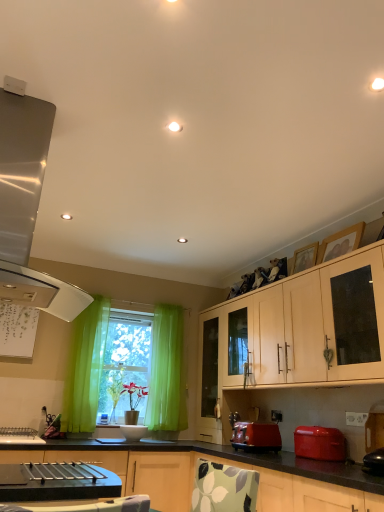
In the scene shown: What is the approximate width of wooden picture frame at upper right, the second picture frame when ordered from front to back?

wooden picture frame at upper right, the second picture frame when ordered from front to back, is 8.00 centimeters wide.

This screenshot has width=384, height=512. What do you see at coordinates (85, 368) in the screenshot? I see `green sheer curtain at window` at bounding box center [85, 368].

The image size is (384, 512). In order to click on green sheer curtain at window in this screenshot , I will do `click(85, 368)`.

Where is `wooden picture frame at upper right, which is the 1th picture frame from back to front`? The width and height of the screenshot is (384, 512). wooden picture frame at upper right, which is the 1th picture frame from back to front is located at coordinates (305, 258).

From the picture: Which of these two, matte red toaster at lower right or matte red toaster at lower center, is thinner?

matte red toaster at lower right.

From the image's perspective, is matte red toaster at lower right beneath matte red toaster at lower center?

No, from the image's perspective, matte red toaster at lower right is not beneath matte red toaster at lower center.

Based on their sizes in the image, would you say matte red toaster at lower right is bigger or smaller than matte red toaster at lower center?

Considering their sizes, matte red toaster at lower right takes up more space than matte red toaster at lower center.

The width and height of the screenshot is (384, 512). Find the location of `appliance on the right of matte red toaster at lower center`. appliance on the right of matte red toaster at lower center is located at coordinates (320, 443).

Which is behind, point (274, 414) or point (311, 442)?

The point (274, 414) is behind.

Would you say white plastic power outlet at lower right is inside or outside matte red toaster at lower right?

white plastic power outlet at lower right is spatially situated outside matte red toaster at lower right.

Is white plastic power outlet at lower right closer to camera compared to matte red toaster at lower right?

No, it is behind matte red toaster at lower right.

Is white plastic power outlet at lower right wider than matte red toaster at lower right?

No.

Is satin metallic range hood at left smaller than white plastic power outlet at lower right?

No, satin metallic range hood at left is not smaller than white plastic power outlet at lower right.

Is satin metallic range hood at left next to white plastic power outlet at lower right?

No, satin metallic range hood at left is not with white plastic power outlet at lower right.

Is satin metallic range hood at left to the left of white plastic power outlet at lower right from the viewer's perspective?

Correct, you'll find satin metallic range hood at left to the left of white plastic power outlet at lower right.

Does matte red toaster at lower center come behind white plastic power outlet at lower right?

That is False.

Is point (235, 433) more distant than point (275, 417)?

No, (235, 433) is in front of (275, 417).

Considering the sizes of objects matte red toaster at lower center and white plastic power outlet at lower right in the image provided, who is wider, matte red toaster at lower center or white plastic power outlet at lower right?

Wider between the two is matte red toaster at lower center.

Is matte red toaster at lower center positioned far away from white plastic power outlet at lower right?

No, there isn't a large distance between matte red toaster at lower center and white plastic power outlet at lower right.

Is white matte cabinet at upper right, which is the first cabinetry in top-to-bottom order, taller or shorter than green sheer curtain at window?

white matte cabinet at upper right, which is the first cabinetry in top-to-bottom order, is shorter than green sheer curtain at window.

Does white matte cabinet at upper right, the 2th cabinetry positioned from the bottom, have a larger size compared to green sheer curtain at window?

Yes.

Is white matte cabinet at upper right, the 2th cabinetry positioned from the bottom, wider than green sheer curtain at window?

Yes.

Is white plastic power outlet at lower right facing towards wooden picture frame at upper right, the second picture frame when ordered from back to front?

No, white plastic power outlet at lower right is not oriented towards wooden picture frame at upper right, the second picture frame when ordered from back to front.

Are white plastic power outlet at lower right and wooden picture frame at upper right, the 1th picture frame positioned from the front, located far from each other?

Yes, white plastic power outlet at lower right and wooden picture frame at upper right, the 1th picture frame positioned from the front, are quite far apart.

Is wooden picture frame at upper right, the second picture frame when ordered from back to front, inside white plastic power outlet at lower right?

Definitely not — wooden picture frame at upper right, the second picture frame when ordered from back to front, is not inside white plastic power outlet at lower right.

Based on the photo, considering the sizes of objects white plastic power outlet at lower right and wooden picture frame at upper right, the 1th picture frame positioned from the front, in the image provided, who is shorter, white plastic power outlet at lower right or wooden picture frame at upper right, the 1th picture frame positioned from the front,?

Standing shorter between the two is white plastic power outlet at lower right.

Looking at this image, how distant is wooden picture frame at upper right, which is the 1th picture frame from back to front, from matte red toaster at lower center?

They are 3.98 feet apart.

Is wooden picture frame at upper right, the second picture frame when ordered from front to back, not close to matte red toaster at lower center?

Absolutely, wooden picture frame at upper right, the second picture frame when ordered from front to back, is distant from matte red toaster at lower center.

Is wooden picture frame at upper right, which is the 1th picture frame from back to front, aimed at matte red toaster at lower center?

No, wooden picture frame at upper right, which is the 1th picture frame from back to front, is not oriented towards matte red toaster at lower center.

From the image's perspective, is wooden picture frame at upper right, which is the 1th picture frame from back to front, above or below matte red toaster at lower center?

Clearly, from the image's perspective, wooden picture frame at upper right, which is the 1th picture frame from back to front, is above matte red toaster at lower center.

Where is `toaster on the left of the matte red toaster at lower right`? This screenshot has width=384, height=512. toaster on the left of the matte red toaster at lower right is located at coordinates (256, 437).

At what (x,y) coordinates should I click in order to perform the action: click on appliance located underneath the white plastic power outlet at lower right (from a real-world perspective). Please return your answer as a coordinate pair (x, y). The height and width of the screenshot is (512, 384). Looking at the image, I should click on (320, 443).

Which object lies further to the anchor point matte white cabinet at center, placed as the 2th cabinetry when sorted from top to bottom, white plastic power outlet at lower right or matte red toaster at lower center?

Based on the image, white plastic power outlet at lower right appears to be further to matte white cabinet at center, placed as the 2th cabinetry when sorted from top to bottom.

Based on their spatial positions, is wooden picture frame at upper right, which is the 1th picture frame from back to front, or satin metallic range hood at left further from matte red toaster at lower center?

satin metallic range hood at left is further to matte red toaster at lower center.

Considering their positions, is matte red toaster at lower center positioned further to matte white cabinet at center, which ranks as the first cabinetry in bottom-to-top order, than white matte cabinet at upper right, which is the first cabinetry in top-to-bottom order?

white matte cabinet at upper right, which is the first cabinetry in top-to-bottom order, is positioned further to the anchor matte white cabinet at center, which ranks as the first cabinetry in bottom-to-top order.

Looking at the image, which one is located further to wooden picture frame at upper right, the 1th picture frame positioned from the front, white matte cabinet at upper right, the 2th cabinetry positioned from the bottom, or matte red toaster at lower center?

matte red toaster at lower center.

Looking at the image, which one is located closer to white matte cabinet at upper right, which is the first cabinetry in top-to-bottom order, wooden picture frame at upper right, the 1th picture frame positioned from the front, or green sheer curtain at window?

wooden picture frame at upper right, the 1th picture frame positioned from the front, lies closer to white matte cabinet at upper right, which is the first cabinetry in top-to-bottom order, than the other object.

From the image, which object appears to be farther from satin metallic range hood at left, wooden picture frame at upper right, which is the 1th picture frame from back to front, or white matte cabinet at upper right, which is the first cabinetry in top-to-bottom order?

wooden picture frame at upper right, which is the 1th picture frame from back to front, lies further to satin metallic range hood at left than the other object.

Based on their spatial positions, is white matte cabinet at upper right, which is the first cabinetry in top-to-bottom order, or matte red toaster at lower right further from wooden picture frame at upper right, the second picture frame when ordered from front to back?

matte red toaster at lower right.

Which object lies nearer to the anchor point white matte cabinet at upper right, which is the first cabinetry in top-to-bottom order, wooden picture frame at upper right, the second picture frame when ordered from front to back, or wooden picture frame at upper right, the 1th picture frame positioned from the front?

Among the two, wooden picture frame at upper right, the second picture frame when ordered from front to back, is located nearer to white matte cabinet at upper right, which is the first cabinetry in top-to-bottom order.

Find the location of `toaster between wooden picture frame at upper right, the second picture frame when ordered from back to front, and matte white cabinet at center, which ranks as the first cabinetry in bottom-to-top order, vertically`. toaster between wooden picture frame at upper right, the second picture frame when ordered from back to front, and matte white cabinet at center, which ranks as the first cabinetry in bottom-to-top order, vertically is located at coordinates (256, 437).

Identify the location of toaster between satin metallic range hood at left and white matte cabinet at upper right, which is the first cabinetry in top-to-bottom order, from left to right. This screenshot has height=512, width=384. (256, 437).

The image size is (384, 512). I want to click on appliance between white matte cabinet at upper right, the 2th cabinetry positioned from the bottom, and matte white cabinet at center, placed as the 2th cabinetry when sorted from top to bottom, in the vertical direction, so click(320, 443).

Image resolution: width=384 pixels, height=512 pixels. I want to click on picture frame between white matte cabinet at upper right, the 2th cabinetry positioned from the bottom, and wooden picture frame at upper right, which is the 1th picture frame from back to front, from front to back, so click(x=341, y=243).